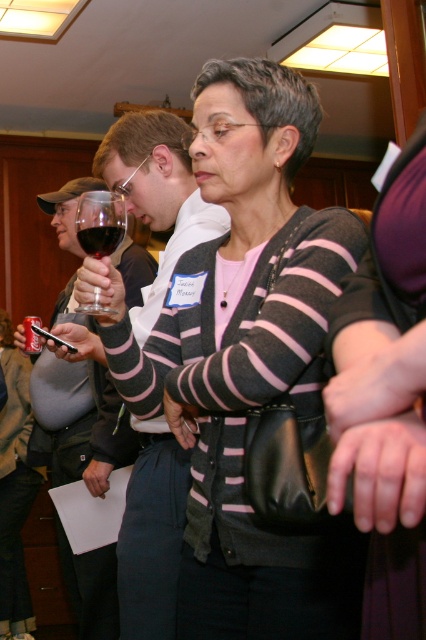
Does point (334, 547) come closer to viewer compared to point (77, 605)?

Yes, it is.

How much distance is there between matte black sweater at center and matte black wine glass at left?

They are 80.30 centimeters apart.

Which is behind, point (236, 324) or point (55, 228)?

Positioned behind is point (55, 228).

What are the coordinates of `matte black sweater at center` in the screenshot? It's located at (247, 358).

Does point (362, 550) come behind point (83, 244)?

No, (362, 550) is closer to viewer.

Can you confirm if matte black sweater at center is wider than dark red liquid at upper left?

Indeed, matte black sweater at center has a greater width compared to dark red liquid at upper left.

Where is `matte black sweater at center`? The image size is (426, 640). matte black sweater at center is located at coordinates (247, 358).

Is matte black wine glass at upper left positioned at the back of matte black wine glass at left?

No, it is in front of matte black wine glass at left.

Does point (167, 502) lie in front of point (60, 529)?

Yes, point (167, 502) is closer to viewer.

Where is `matte black wine glass at upper left`? The height and width of the screenshot is (640, 426). matte black wine glass at upper left is located at coordinates (158, 193).